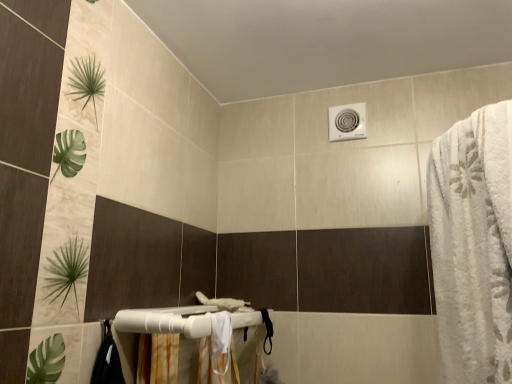
Question: Is white plastic towel bar at lower center positioned beyond the bounds of white fabric shower curtain at lower center?

Choices:
 (A) no
 (B) yes

Answer: (B)

Question: Does white plastic towel bar at lower center have a lesser height compared to white fabric shower curtain at lower center?

Choices:
 (A) no
 (B) yes

Answer: (B)

Question: Is the position of white plastic towel bar at lower center less distant than that of white fabric shower curtain at lower center?

Choices:
 (A) no
 (B) yes

Answer: (B)

Question: From a real-world perspective, is white plastic towel bar at lower center located higher than white fabric shower curtain at lower center?

Choices:
 (A) yes
 (B) no

Answer: (A)

Question: From the image's perspective, is white plastic towel bar at lower center beneath white fabric shower curtain at lower center?

Choices:
 (A) no
 (B) yes

Answer: (A)

Question: Is white plastic towel bar at lower center with white fabric shower curtain at lower center?

Choices:
 (A) yes
 (B) no

Answer: (B)

Question: Can you confirm if white fabric shower curtain at lower center is bigger than white plastic towel bar at lower center?

Choices:
 (A) no
 (B) yes

Answer: (A)

Question: From the image's perspective, is white fabric shower curtain at lower center located beneath white plastic towel bar at lower center?

Choices:
 (A) no
 (B) yes

Answer: (B)

Question: From a real-world perspective, is white fabric shower curtain at lower center located higher than white plastic towel bar at lower center?

Choices:
 (A) yes
 (B) no

Answer: (B)

Question: Is white fabric shower curtain at lower center located outside white plastic towel bar at lower center?

Choices:
 (A) yes
 (B) no

Answer: (A)

Question: Is white fabric shower curtain at lower center looking in the opposite direction of white plastic towel bar at lower center?

Choices:
 (A) yes
 (B) no

Answer: (B)

Question: Can you confirm if white fabric shower curtain at lower center is shorter than white plastic towel bar at lower center?

Choices:
 (A) yes
 (B) no

Answer: (B)

Question: From a real-world perspective, is white fabric shower curtain at lower center positioned under white fluffy bath towel at right based on gravity?

Choices:
 (A) no
 (B) yes

Answer: (B)